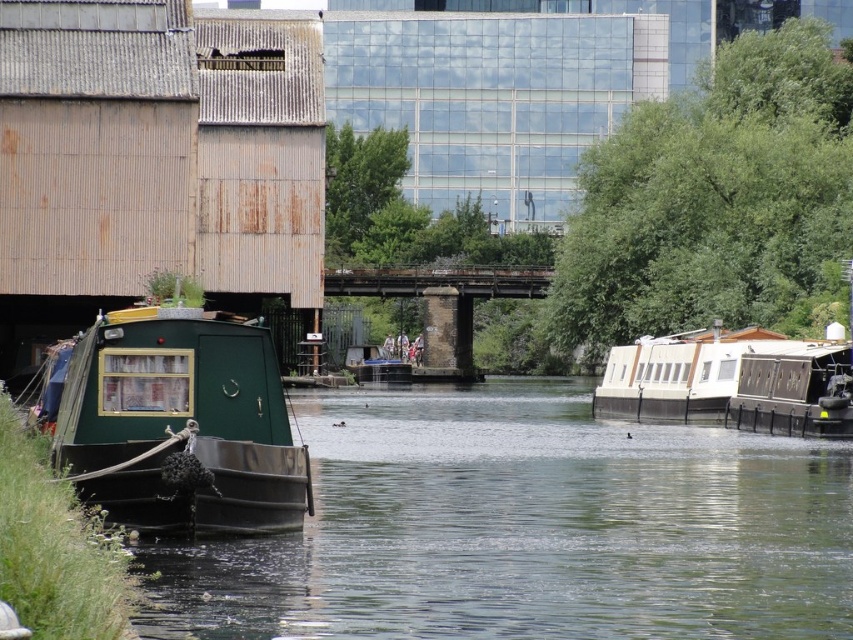
Question: Considering the relative positions of green matte houseboat at left and white glossy houseboat at right in the image provided, where is green matte houseboat at left located with respect to white glossy houseboat at right?

Choices:
 (A) left
 (B) right

Answer: (A)

Question: Is green matte boat at left wider than white glossy houseboat at right?

Choices:
 (A) no
 (B) yes

Answer: (B)

Question: Which object is the farthest from the green matte houseboat at left?

Choices:
 (A) green matte boat at left
 (B) white glossy houseboat at right

Answer: (B)

Question: Which of the following is the closest to the observer?

Choices:
 (A) green matte houseboat at left
 (B) green matte boat at left
 (C) white glossy houseboat at right

Answer: (B)

Question: Which point appears farthest from the camera in this image?

Choices:
 (A) (595, 422)
 (B) (769, 355)
 (C) (223, 349)

Answer: (A)

Question: Can you confirm if green matte boat at left is thinner than white glossy houseboat at right?

Choices:
 (A) yes
 (B) no

Answer: (B)